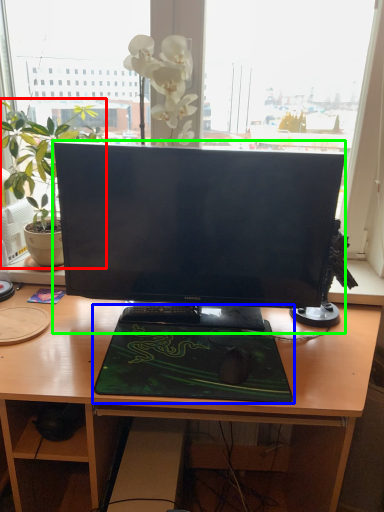
Question: Which object is the closest to the houseplant (highlighted by a red box)? Choose among these: desktop (highlighted by a blue box) or computer monitor (highlighted by a green box).

Choices:
 (A) desktop
 (B) computer monitor

Answer: (B)